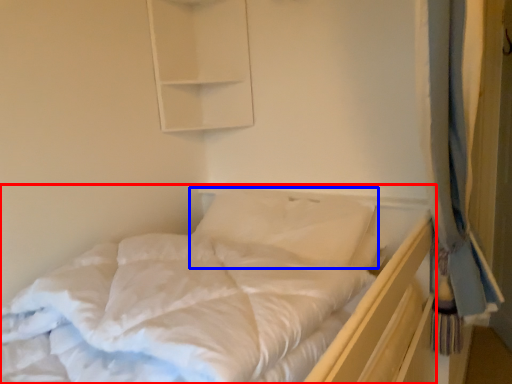
Question: Which of the following is the farthest to the observer, bed (highlighted by a red box) or pillow (highlighted by a blue box)?

Choices:
 (A) bed
 (B) pillow

Answer: (B)